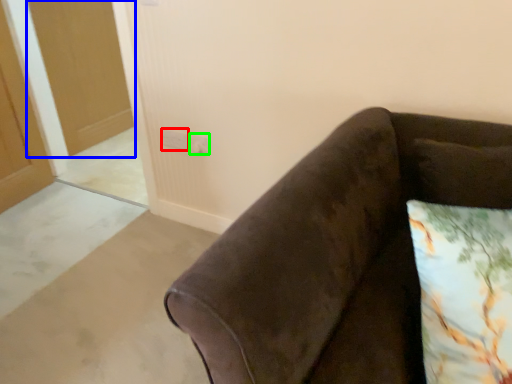
Question: Estimate the real-world distances between objects in this image. Which object is closer to electric outlet (highlighted by a red box), glass door (highlighted by a blue box) or electric outlet (highlighted by a green box)?

Choices:
 (A) glass door
 (B) electric outlet

Answer: (B)